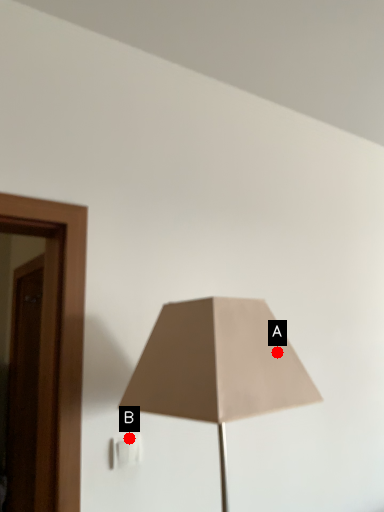
Question: Two points are circled on the image, labeled by A and B beside each circle. Which point is closer to the camera taking this photo?

Choices:
 (A) A is closer
 (B) B is closer

Answer: (A)